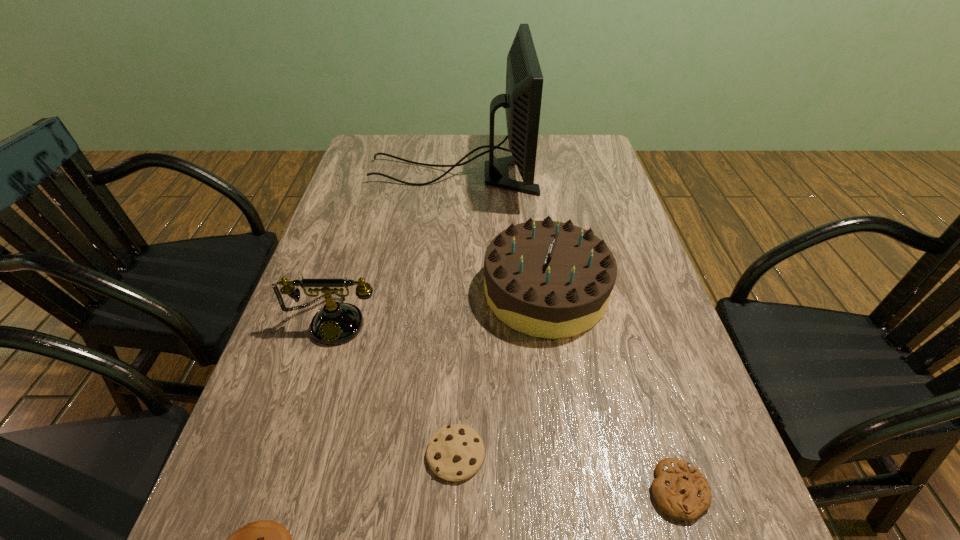
The image size is (960, 540). In order to click on vacant space located on the front-facing side of the birthday cake in this screenshot , I will do `click(449, 292)`.

This screenshot has height=540, width=960. Identify the location of vacant space situated on the front-facing side of the birthday cake. (360, 292).

Find the location of a particular element. This screenshot has width=960, height=540. vacant space located 0.270m on the dial of the telephone is located at coordinates (288, 478).

The width and height of the screenshot is (960, 540). Identify the location of vacant position located on the left of the tallest cookie. pos(304,454).

This screenshot has height=540, width=960. Find the location of `vacant space located 0.060m on the left of the rightmost cookie`. vacant space located 0.060m on the left of the rightmost cookie is located at coordinates (612, 490).

Identify the location of object that is at the far edge. The width and height of the screenshot is (960, 540). (524, 81).

The height and width of the screenshot is (540, 960). Find the location of `computer monitor that is at the left edge`. computer monitor that is at the left edge is located at coordinates (524, 81).

The height and width of the screenshot is (540, 960). Identify the location of telephone at the left edge. (336, 323).

Where is `birthday cake at the right edge`? birthday cake at the right edge is located at coordinates click(548, 279).

This screenshot has width=960, height=540. What are the coordinates of `cookie that is at the right edge` in the screenshot? It's located at (681, 491).